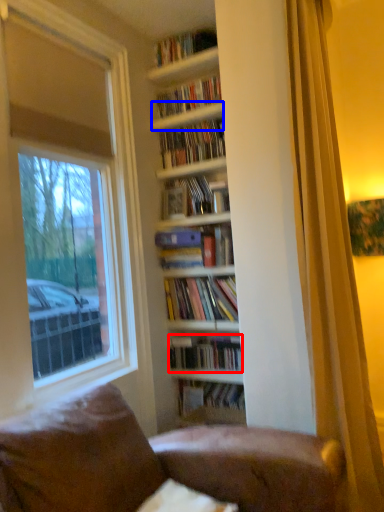
Question: Which point is closer to the camera, book (highlighted by a red box) or shelf (highlighted by a blue box)?

Choices:
 (A) book
 (B) shelf

Answer: (A)